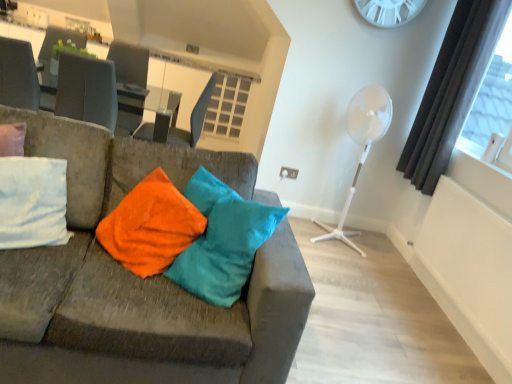
Question: From the image's perspective, is matte black swivel chair at center above or below white plastic clock at upper center?

Choices:
 (A) above
 (B) below

Answer: (B)

Question: Is point (200, 110) positioned closer to the camera than point (421, 4)?

Choices:
 (A) closer
 (B) farther

Answer: (B)

Question: Estimate the real-world distances between objects in this image. Which object is closer to the velvet fabric couch at left?

Choices:
 (A) white plastic fan at right
 (B) glassy white table at upper center
 (C) dark gray curtain at right
 (D) matte black swivel chair at center
 (E) white plastic clock at upper center

Answer: (B)

Question: Which is farther from the matte black swivel chair at center?

Choices:
 (A) glassy white table at upper center
 (B) dark gray curtain at right
 (C) white plastic clock at upper center
 (D) velvet fabric couch at left
 (E) white plastic fan at right

Answer: (B)